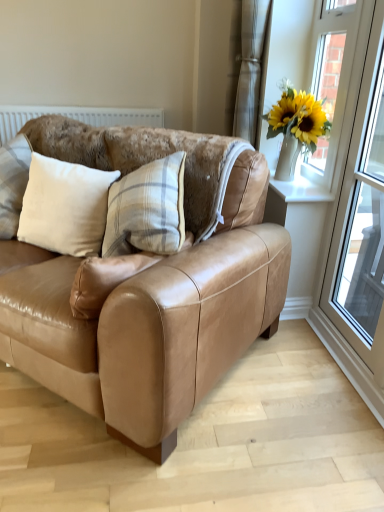
Question: Is white glass window at upper right inside or outside of white textured curtain at upper center?

Choices:
 (A) outside
 (B) inside

Answer: (A)

Question: In terms of width, does white glass window at upper right look wider or thinner when compared to white textured curtain at upper center?

Choices:
 (A) wide
 (B) thin

Answer: (B)

Question: Which is nearer to the white textured curtain at upper center?

Choices:
 (A) tan leather couch at center
 (B) white glass window at upper right
 (C) beige fabric pillow at left
 (D) white plastic window frame at right
 (E) white smooth window sill at upper right

Answer: (B)

Question: Considering the real-world distances, which object is closest to the white glass window at upper right?

Choices:
 (A) tan leather couch at center
 (B) white textured curtain at upper center
 (C) white plastic window frame at right
 (D) beige fabric pillow at left
 (E) white smooth window sill at upper right

Answer: (C)